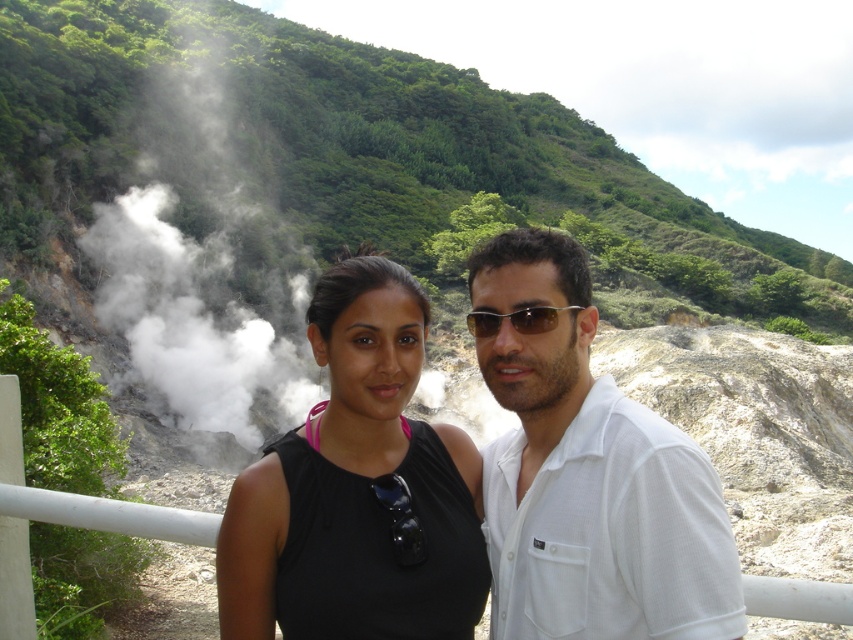
Question: Among these objects, which one is nearest to the camera?

Choices:
 (A) white plastic rail at center
 (B) green leafy hillside at upper left
 (C) metallic reflective sunglasses at center

Answer: (A)

Question: Can you confirm if black matte tank top at center is positioned to the left of white vapor at left?

Choices:
 (A) no
 (B) yes

Answer: (A)

Question: Does green leafy hillside at upper left appear on the left side of white textured shirt at center?

Choices:
 (A) yes
 (B) no

Answer: (B)

Question: From the image, what is the correct spatial relationship of green leafy hillside at upper left in relation to black matte tank top at center?

Choices:
 (A) right
 (B) left

Answer: (A)

Question: Which point is farther to the camera?

Choices:
 (A) green leafy hillside at upper left
 (B) black matte tank top at center
 (C) white textured shirt at center

Answer: (A)

Question: Among these points, which one is nearest to the camera?

Choices:
 (A) (827, 596)
 (B) (154, 141)

Answer: (A)